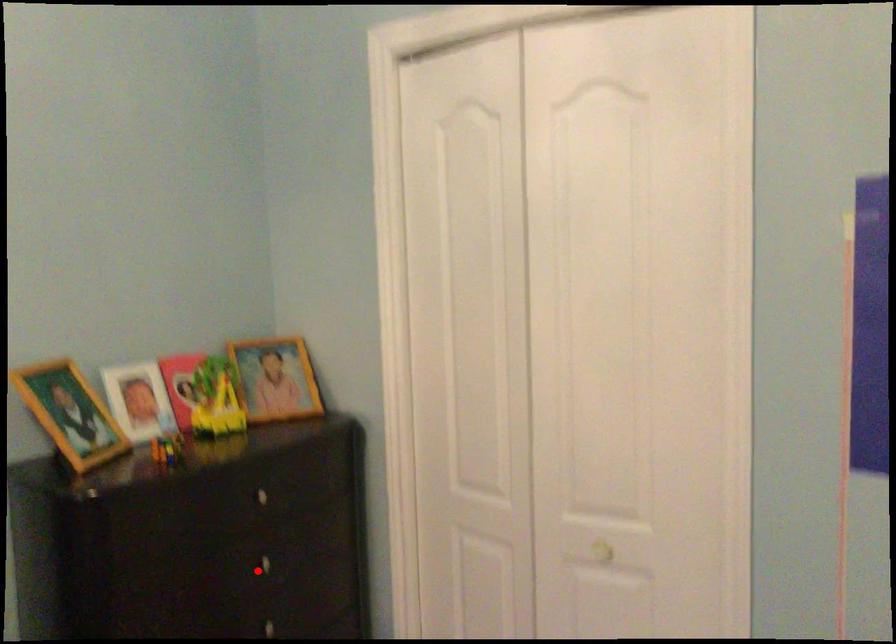
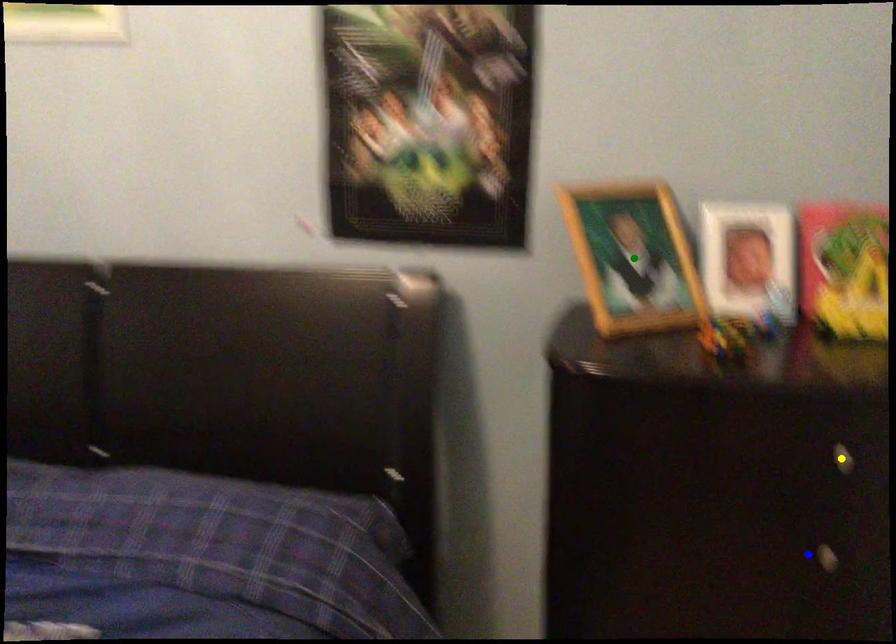
Question: I am providing you with two images of the same scene from different viewpoints. A red point is marked on the first image. You are given multiple points on the second image. Which point in image 2 represents the same 3d spot as the red point in image 1?

Choices:
 (A) blue point
 (B) yellow point
 (C) green point

Answer: (A)